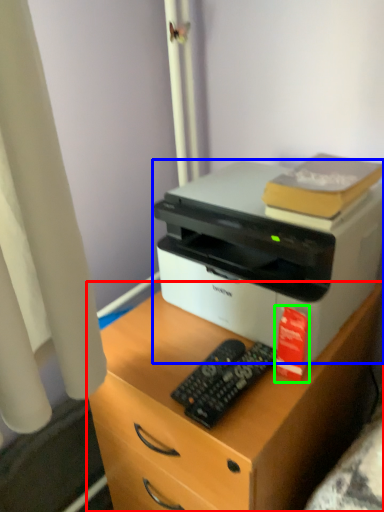
Question: Which object is the farthest from desk (highlighted by a red box)? Choose among these: printer (highlighted by a blue box) or book (highlighted by a green box).

Choices:
 (A) printer
 (B) book

Answer: (B)